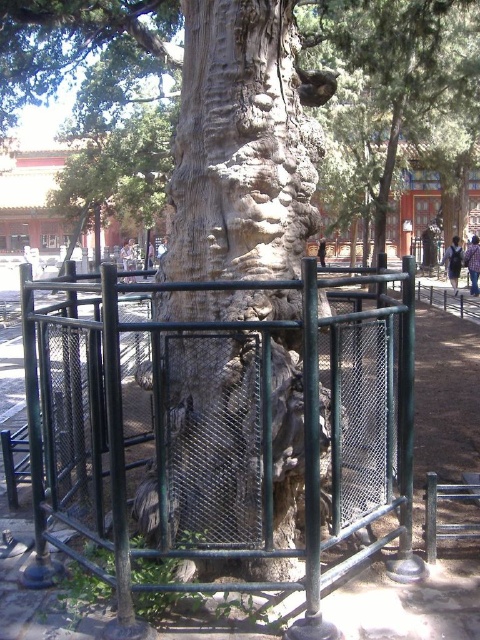
You are a park ranger who needs to place a new 2.5 meter wide protective barrier between the green metal fence at center and the rough bark tree at center. Is there enough space to place it without touching either structure?

The distance between the green metal fence at center and the rough bark tree at center is 3.06 meters. Since the barrier is 2.5 meters wide, there is enough space to place it between them without touching either structure.

You are standing in front of the ancient tree and need to locate the rough bark tree trunk at center. According to the coordinates provided, where exactly is it positioned?

The rough bark tree trunk at center is located at point coordinates (242, 145).